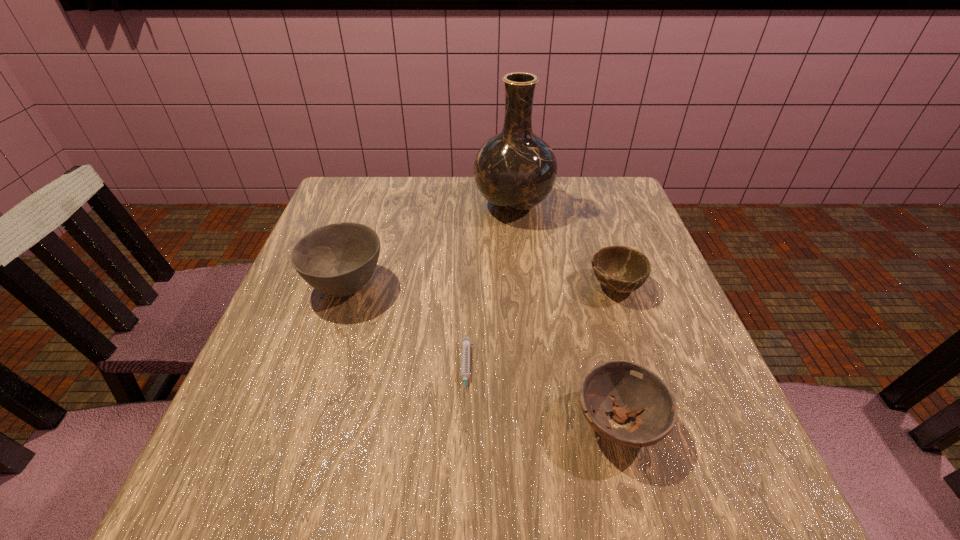
Locate an element on the screen. free location at the near right corner is located at coordinates (696, 516).

Where is `empty space between the leftmost bowl and the nearest bowl`? This screenshot has height=540, width=960. empty space between the leftmost bowl and the nearest bowl is located at coordinates (482, 353).

This screenshot has width=960, height=540. Identify the location of vacant space that's between the farthest object and the nearest bowl. (565, 314).

I want to click on empty space between the tallest object and the tallest bowl, so click(429, 245).

The height and width of the screenshot is (540, 960). Identify the location of vacant region between the vase and the nearest bowl. (565, 314).

Locate an element on the screen. The image size is (960, 540). unoccupied area between the second tallest object and the vase is located at coordinates (429, 245).

Identify which object is located as the fourth nearest to the nearest bowl. Please provide its 2D coordinates. Your answer should be formatted as a tuple, i.e. [(x, y)], where the tuple contains the x and y coordinates of a point satisfying the conditions above.

[(515, 170)]

Locate an element on the screen. This screenshot has height=540, width=960. the fourth closest object to the syringe is located at coordinates (515, 170).

Find the location of a particular element. The height and width of the screenshot is (540, 960). bowl that stands as the closest to the leftmost bowl is located at coordinates (627, 389).

Locate which bowl is the closest to the leftmost object. Please provide its 2D coordinates. Your answer should be formatted as a tuple, i.e. [(x, y)], where the tuple contains the x and y coordinates of a point satisfying the conditions above.

[(627, 389)]